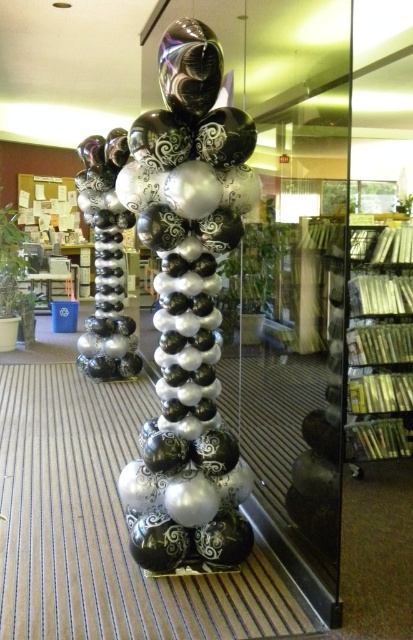
You are standing in the room and see two points marked on the floor near the balloon column. One is at point (209, 257) and the other at point (374, 400). Which point is closer to you?

Point (209, 257) is in front of point (374, 400), so it is closer to you.